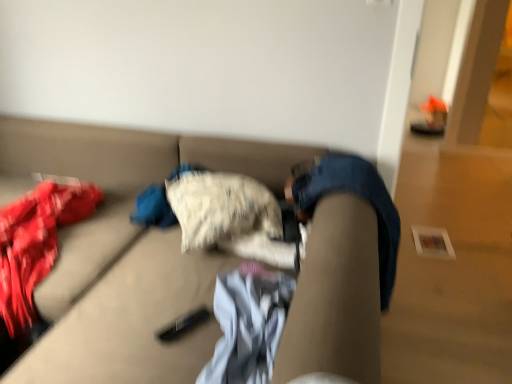
Measure the distance between white cotton shirt at center and camera.

white cotton shirt at center and camera are 39.31 inches apart from each other.

The width and height of the screenshot is (512, 384). I want to click on white cotton shirt at center, so click(x=248, y=324).

Image resolution: width=512 pixels, height=384 pixels. Describe the element at coordinates (248, 324) in the screenshot. I see `white cotton shirt at center` at that location.

Image resolution: width=512 pixels, height=384 pixels. What are the coordinates of `textured beige couch at center` in the screenshot? It's located at (127, 251).

What do you see at coordinates (127, 251) in the screenshot? I see `textured beige couch at center` at bounding box center [127, 251].

Locate an element on the screen. white cotton shirt at center is located at coordinates (248, 324).

Visually, is white cotton shirt at center positioned to the left or to the right of textured beige couch at center?

In the image, white cotton shirt at center appears on the right side of textured beige couch at center.

Is the depth of white cotton shirt at center greater than that of textured beige couch at center?

Yes, it is.

Which is closer, (257, 379) or (132, 303)?

The point (257, 379) is more forward.

From the image's perspective, is white cotton shirt at center above or below textured beige couch at center?

Based on their image positions, white cotton shirt at center is located beneath textured beige couch at center.

From a real-world perspective, is white cotton shirt at center positioned above or below textured beige couch at center?

white cotton shirt at center is situated higher than textured beige couch at center in the real world.

In terms of width, does white cotton shirt at center look wider or thinner when compared to textured beige couch at center?

Clearly, white cotton shirt at center has less width compared to textured beige couch at center.

Looking at this image, between white cotton shirt at center and textured beige couch at center, which one has less height?

Standing shorter between the two is white cotton shirt at center.

Between white cotton shirt at center and textured beige couch at center, which one has larger size?

Bigger between the two is textured beige couch at center.

Would you say white cotton shirt at center is outside textured beige couch at center?

No.

Is white cotton shirt at center not close to textured beige couch at center?

No, white cotton shirt at center is not far from textured beige couch at center.

Is white cotton shirt at center oriented towards textured beige couch at center?

Yes.

How many degrees apart are the facing directions of white cotton shirt at center and textured beige couch at center?

The angle between the facing direction of white cotton shirt at center and the facing direction of textured beige couch at center is 82.1 degrees.

Looking at this image, how far apart are white cotton shirt at center and textured beige couch at center?

They are 14.71 inches apart.

The width and height of the screenshot is (512, 384). In order to click on baby clothe above the textured beige couch at center (from a real-world perspective) in this screenshot , I will do `click(248, 324)`.

Considering the positions of objects textured beige couch at center and white cotton shirt at center in the image provided, who is more to the right, textured beige couch at center or white cotton shirt at center?

white cotton shirt at center is more to the right.

Is the depth of textured beige couch at center less than that of white cotton shirt at center?

That is True.

Which is behind, point (182, 141) or point (275, 278)?

The point (182, 141) is farther from the camera.

From the image's perspective, which one is positioned lower, textured beige couch at center or white cotton shirt at center?

white cotton shirt at center.

From a real-world perspective, is textured beige couch at center under white cotton shirt at center?

Yes, from a real-world perspective, textured beige couch at center is below white cotton shirt at center.

Does textured beige couch at center have a lesser width compared to white cotton shirt at center?

No, textured beige couch at center is not thinner than white cotton shirt at center.

Between textured beige couch at center and white cotton shirt at center, which one has more height?

textured beige couch at center.

Is textured beige couch at center smaller than white cotton shirt at center?

No, textured beige couch at center is not smaller than white cotton shirt at center.

Do you think textured beige couch at center is within white cotton shirt at center, or outside of it?

textured beige couch at center lies outside white cotton shirt at center.

Is textured beige couch at center beside white cotton shirt at center?

They are not placed beside each other.

Could you tell me if textured beige couch at center is facing white cotton shirt at center?

Yes, textured beige couch at center is aimed at white cotton shirt at center.

Looking at this image, can you tell me how much textured beige couch at center and white cotton shirt at center differ in facing direction?

82.1 degrees separate the facing orientations of textured beige couch at center and white cotton shirt at center.

Identify the location of studio couch to the left of white cotton shirt at center. (127, 251).

I want to click on baby clothe above the textured beige couch at center (from a real-world perspective), so click(x=248, y=324).

This screenshot has width=512, height=384. I want to click on baby clothe on the right of textured beige couch at center, so click(248, 324).